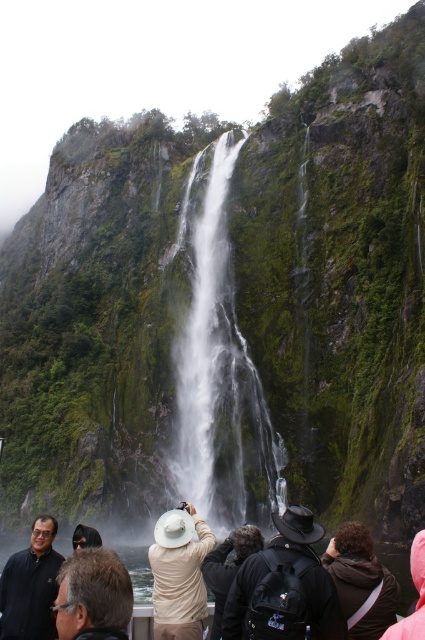
You are a photographer trying to capture a clear shot of the waterfall. You notice a black fabric backpack at center and a dark gray fabric hat at center in the foreground. Which object should you move to avoid blocking the view?

The black fabric backpack at center is on the right side of the dark gray fabric hat at center. To avoid blocking the view, you should move the black fabric backpack at center since it is positioned further to the right and closer to the center of the frame where the waterfall is located.

You are standing at the coordinate origin of this scenic area. The white smooth waterfall at center is located at point 0.584, 0.518. If you want to reach the waterfall as quickly as possible, which direction should you move in?

To reach the white smooth waterfall at center located at coordinates (220,372) as quickly as possible, you should move directly toward that coordinate point. Since the waterfall is at the center of the image, moving straight ahead would be the most efficient path.

You are a hiker who wants to know if your black fabric backpack at center can fit into the same space where the dark gray fabric hat at center is currently placed. Based on their sizes, can the backpack fit?

The black fabric backpack at center is wider than the dark gray fabric hat at center, so it cannot fit into the same space where the dark gray fabric hat at center is currently placed.